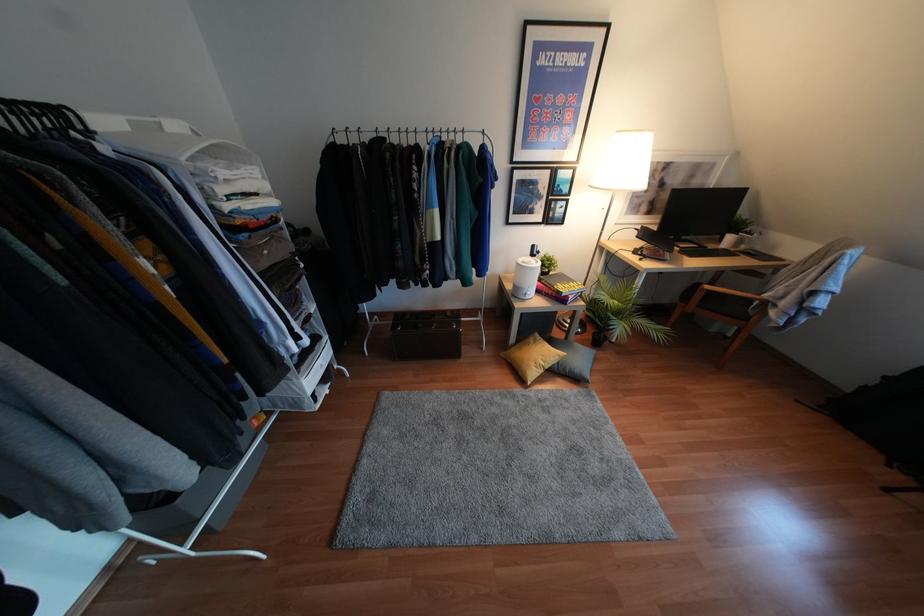
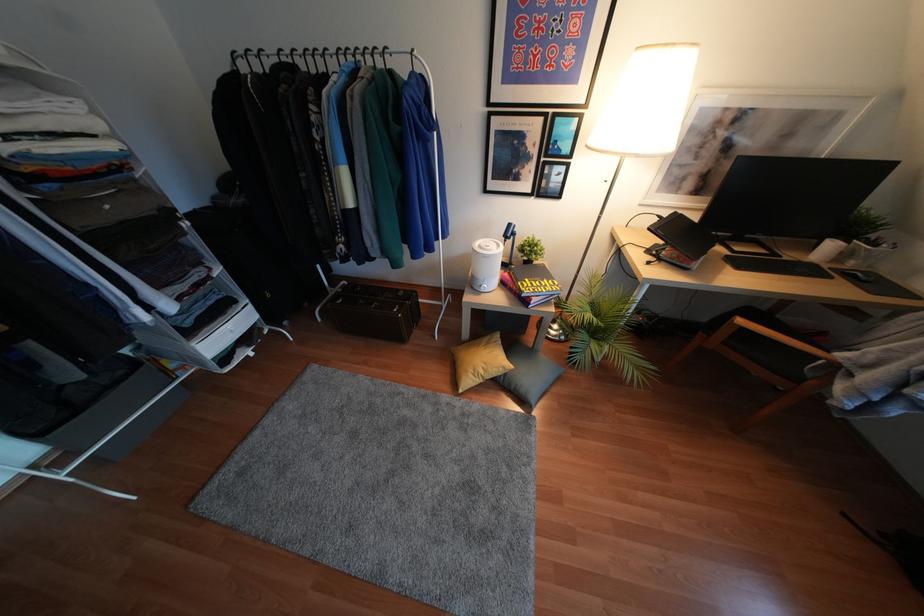
Which direction would the cameraman need to move to produce the second image?

The movement direction of the cameraman is right, forward.